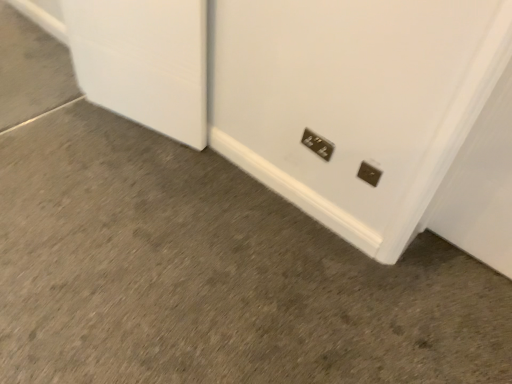
Question: From a real-world perspective, relative to metallic silver power plug at lower right, positioned as the second power plugs and sockets in left-to-right order, is metallic silver power plugs and sockets at lower center, positioned as the first power plugs and sockets in top-to-bottom order, vertically above or below?

Choices:
 (A) below
 (B) above

Answer: (A)

Question: Based on their positions, is metallic silver power plugs and sockets at lower center, the 2th power plugs and sockets in the front-to-back sequence, located to the left or right of metallic silver power plug at lower right, the 2th power plugs and sockets in the back-to-front sequence?

Choices:
 (A) left
 (B) right

Answer: (A)

Question: In terms of width, does metallic silver power plugs and sockets at lower center, which is the first power plugs and sockets from back to front, look wider or thinner when compared to metallic silver power plug at lower right, arranged as the first power plugs and sockets when ordered from the bottom?

Choices:
 (A) wide
 (B) thin

Answer: (A)

Question: Is metallic silver power plug at lower right, positioned as the second power plugs and sockets in left-to-right order, taller or shorter than metallic silver power plugs and sockets at lower center, which is the first power plugs and sockets from back to front?

Choices:
 (A) short
 (B) tall

Answer: (A)

Question: Is metallic silver power plug at lower right, the 1th power plugs and sockets viewed from the right, inside the boundaries of metallic silver power plugs and sockets at lower center, which is the first power plugs and sockets from back to front, or outside?

Choices:
 (A) outside
 (B) inside

Answer: (A)

Question: From the image's perspective, is metallic silver power plug at lower right, arranged as the first power plugs and sockets when ordered from the bottom, positioned above or below metallic silver power plugs and sockets at lower center, the 2th power plugs and sockets in the front-to-back sequence?

Choices:
 (A) above
 (B) below

Answer: (B)

Question: Considering their positions, is metallic silver power plug at lower right, the 1th power plugs and sockets viewed from the right, located in front of or behind metallic silver power plugs and sockets at lower center, the 2th power plugs and sockets in the bottom-to-top sequence?

Choices:
 (A) behind
 (B) front

Answer: (B)